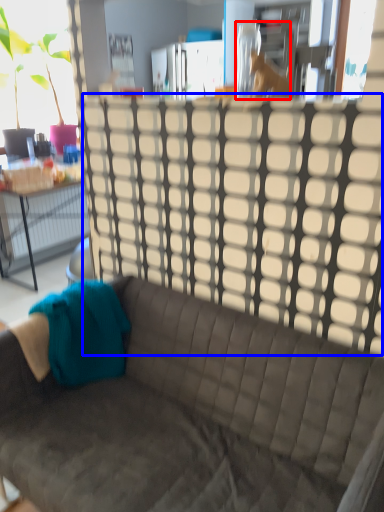
Question: Among these objects, which one is nearest to the camera, animal (highlighted by a red box) or glass door (highlighted by a blue box)?

Choices:
 (A) animal
 (B) glass door

Answer: (B)